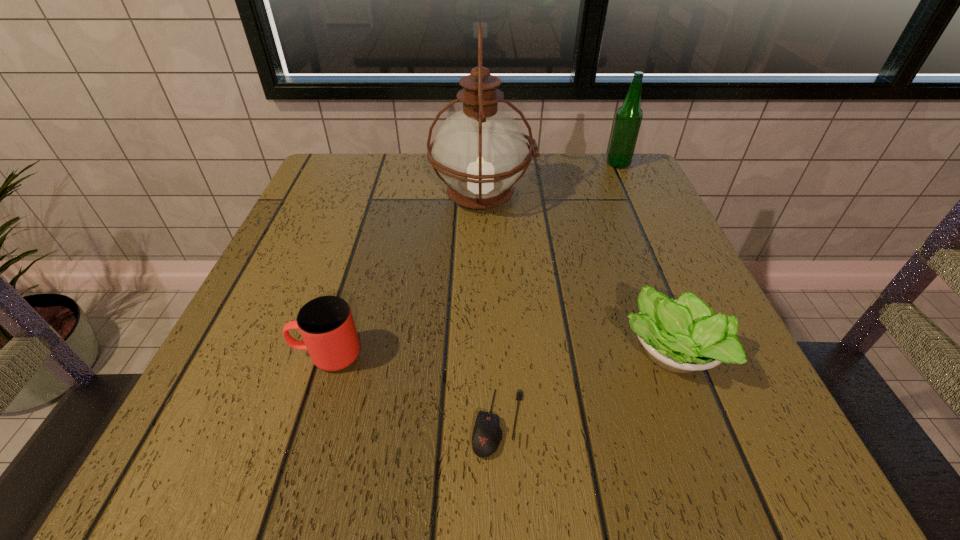
Locate an element on the screen. The image size is (960, 540). object present at the far right corner is located at coordinates (629, 116).

In order to click on vacant region at the far edge of the desktop in this screenshot , I will do `click(575, 199)`.

Where is `vacant region at the near edge`? The image size is (960, 540). vacant region at the near edge is located at coordinates (337, 444).

You are a GUI agent. You are given a task and a screenshot of the screen. Output one action in this format:
    pyautogui.click(x=<x>, y=<y>)
    Task: Click on the free space at the left edge of the desktop
    The width and height of the screenshot is (960, 540).
    Given the screenshot: What is the action you would take?
    pyautogui.click(x=254, y=302)

The height and width of the screenshot is (540, 960). In the image, there is a desktop. Identify the location of vacant space at the right edge. (617, 208).

At what (x,y) coordinates should I click in order to perform the action: click on vacant space at the far left corner of the desktop. Please return your answer as a coordinate pair (x, y). Looking at the image, I should click on (381, 160).

Find the location of a particular element. The width and height of the screenshot is (960, 540). vacant space at the near left corner of the desktop is located at coordinates (256, 462).

You are a GUI agent. You are given a task and a screenshot of the screen. Output one action in this format:
    pyautogui.click(x=<x>, y=<y>)
    Task: Click on the free space at the far right corner of the desktop
    This screenshot has width=960, height=540.
    Given the screenshot: What is the action you would take?
    pyautogui.click(x=626, y=172)

Find the location of `vacant position at the near right corner of the desktop`. vacant position at the near right corner of the desktop is located at coordinates (768, 431).

Locate an element on the screen. free space between the mouse and the tallest object is located at coordinates (491, 310).